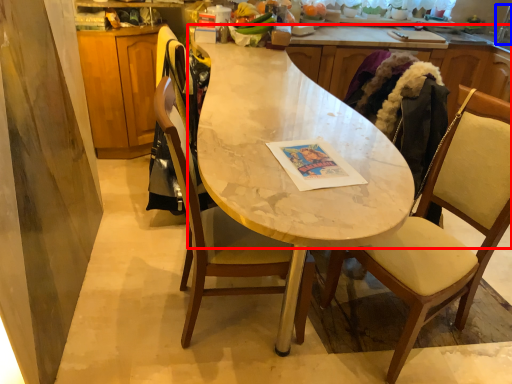
Question: Which point is closer to the camera, countertop (highlighted by a red box) or faucet (highlighted by a blue box)?

Choices:
 (A) countertop
 (B) faucet

Answer: (A)